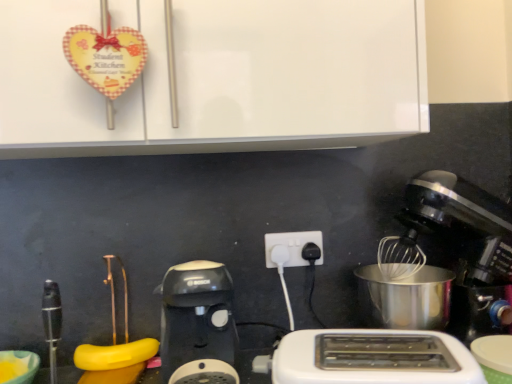
Question: Considering the relative sizes of metallic silver mixer at right and white plastic toaster at lower center in the image provided, is metallic silver mixer at right wider than white plastic toaster at lower center?

Choices:
 (A) no
 (B) yes

Answer: (B)

Question: Does metallic silver mixer at right have a larger size compared to white plastic toaster at lower center?

Choices:
 (A) yes
 (B) no

Answer: (A)

Question: From the image's perspective, is metallic silver mixer at right over white plastic toaster at lower center?

Choices:
 (A) yes
 (B) no

Answer: (A)

Question: Is metallic silver mixer at right located outside white plastic toaster at lower center?

Choices:
 (A) yes
 (B) no

Answer: (A)

Question: Considering the relative sizes of metallic silver mixer at right and white plastic toaster at lower center in the image provided, is metallic silver mixer at right taller than white plastic toaster at lower center?

Choices:
 (A) no
 (B) yes

Answer: (B)

Question: Is metallic silver mixer at right oriented away from white plastic toaster at lower center?

Choices:
 (A) yes
 (B) no

Answer: (B)

Question: From a real-world perspective, is white plastic power plug at center on top of matte yellow bowl at lower left?

Choices:
 (A) no
 (B) yes

Answer: (B)

Question: Is white plastic power plug at center wider than matte yellow bowl at lower left?

Choices:
 (A) no
 (B) yes

Answer: (A)

Question: Is white plastic power plug at center positioned behind matte yellow bowl at lower left?

Choices:
 (A) no
 (B) yes

Answer: (B)

Question: Can you confirm if white plastic power plug at center is taller than matte yellow bowl at lower left?

Choices:
 (A) yes
 (B) no

Answer: (A)

Question: Are white plastic power plug at center and matte yellow bowl at lower left making contact?

Choices:
 (A) no
 (B) yes

Answer: (A)

Question: Can you confirm if white plastic power plug at center is smaller than matte yellow bowl at lower left?

Choices:
 (A) no
 (B) yes

Answer: (B)

Question: From the image's perspective, does white glossy cabinet at upper center appear lower than white plastic toaster at lower center?

Choices:
 (A) no
 (B) yes

Answer: (A)